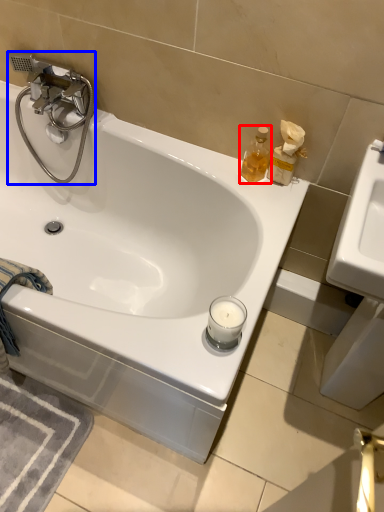
Question: Which object is closer to the camera taking this photo, soap dispenser (highlighted by a red box) or tap (highlighted by a blue box)?

Choices:
 (A) soap dispenser
 (B) tap

Answer: (A)